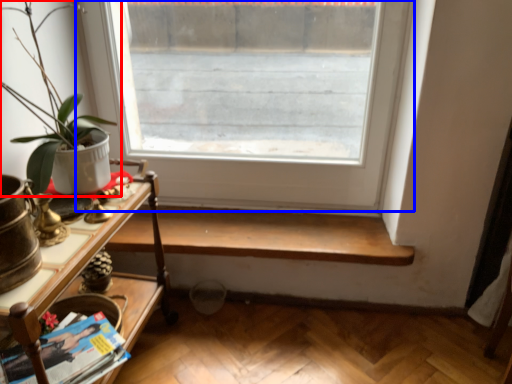
Question: Which object is further to the camera taking this photo, houseplant (highlighted by a red box) or window (highlighted by a blue box)?

Choices:
 (A) houseplant
 (B) window

Answer: (B)